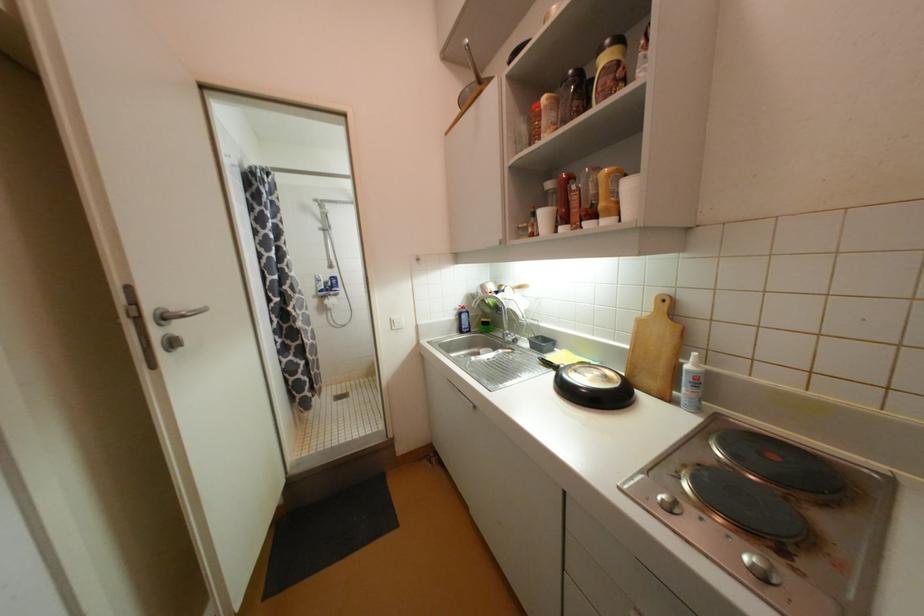
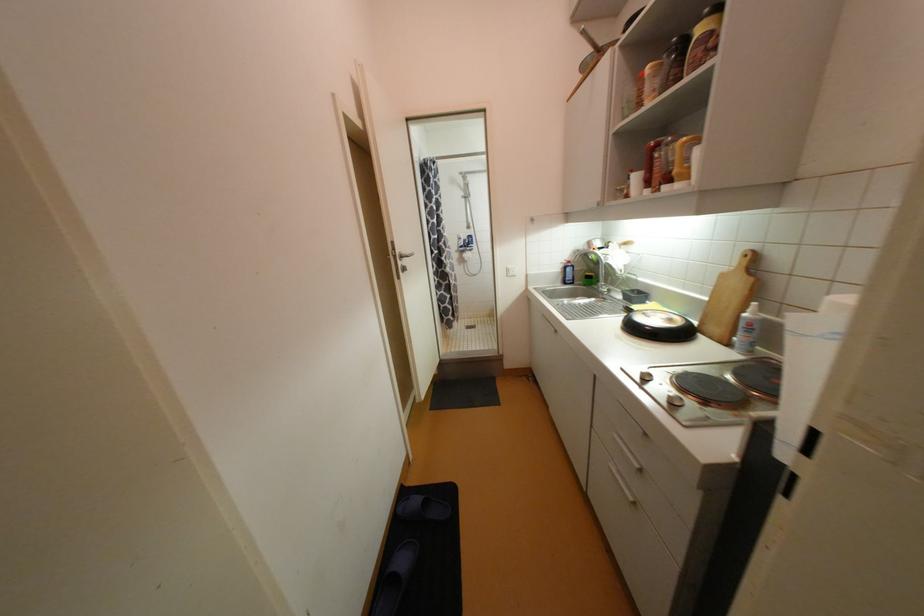
Where in the second image is the point corresponding to (541,357) from the first image?

(628, 305)